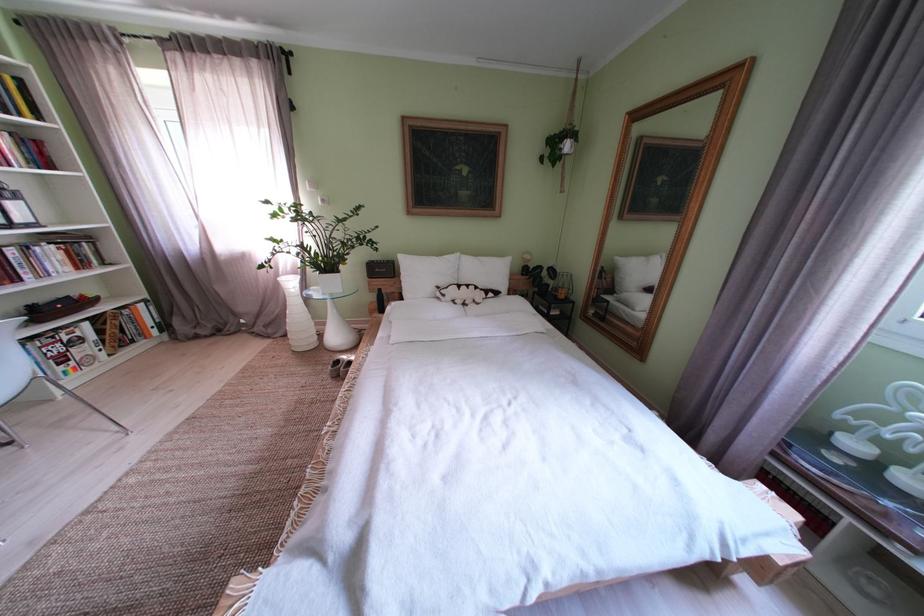
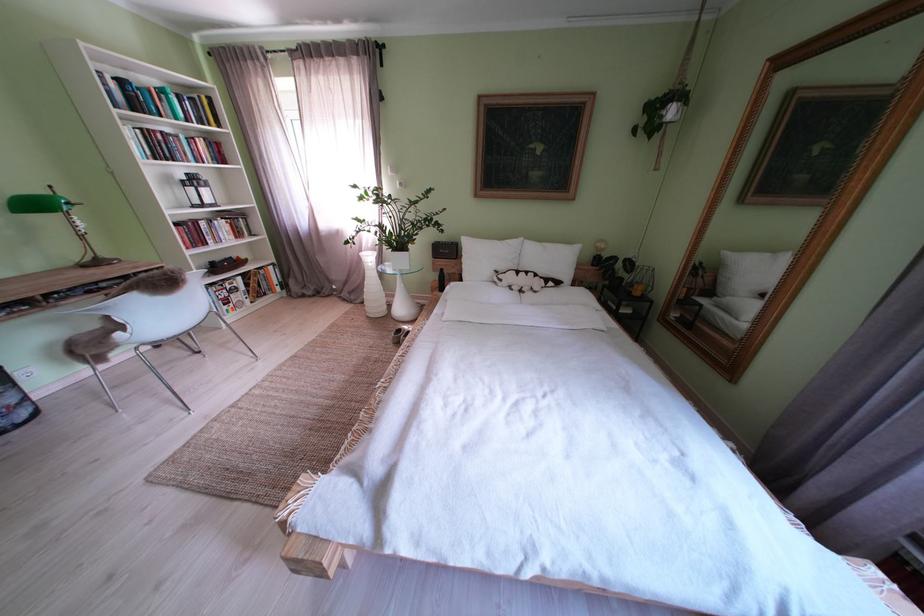
Locate, in the second image, the point that corresponds to [333,278] in the first image.

(405, 256)